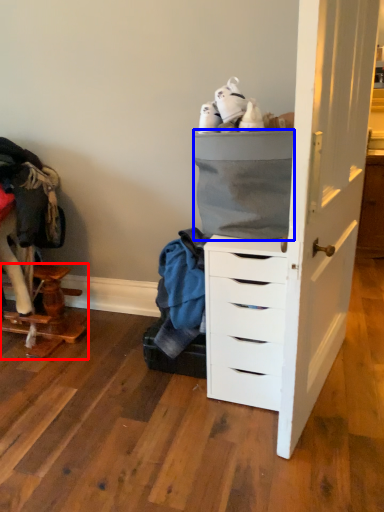
Question: Which object appears closest to the camera in this image, furniture (highlighted by a red box) or cabinetry (highlighted by a blue box)?

Choices:
 (A) furniture
 (B) cabinetry

Answer: (B)